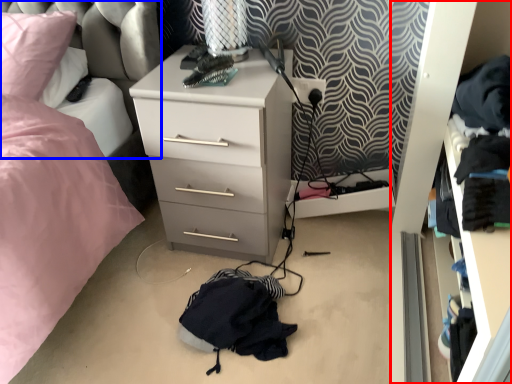
Question: Which object is closer to the camera taking this photo, dresser (highlighted by a red box) or swivel chair (highlighted by a blue box)?

Choices:
 (A) dresser
 (B) swivel chair

Answer: (A)